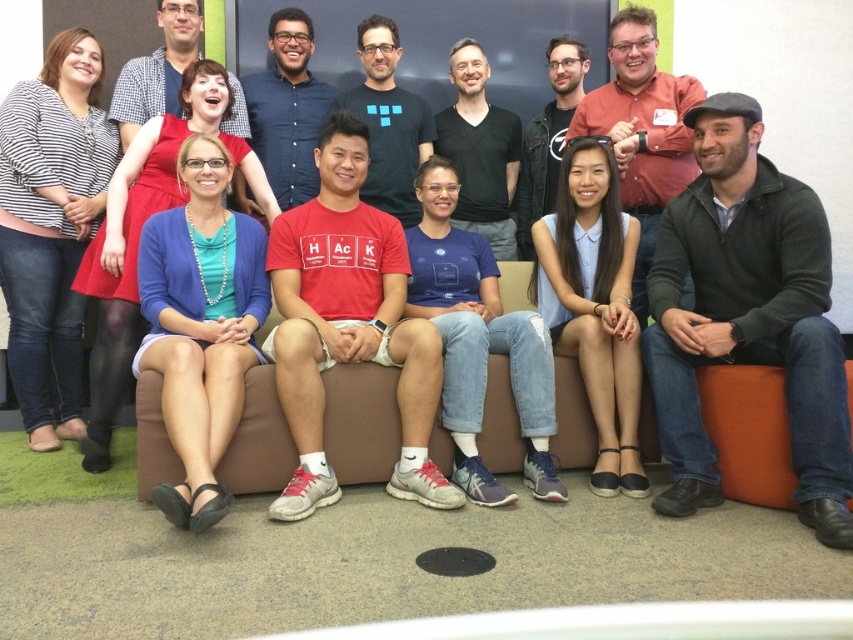
Is the position of white cotton t-shirt at center less distant than that of blue cotton shirt at center?

That is True.

Can you confirm if white cotton t-shirt at center is wider than blue cotton shirt at center?

Yes.

Is point (358, 358) closer to viewer compared to point (476, 380)?

Yes.

At what (x,y) coordinates should I click in order to perform the action: click on white cotton t-shirt at center. Please return your answer as a coordinate pair (x, y). This screenshot has width=853, height=640. Looking at the image, I should click on (347, 324).

How distant is blue cotton shirt at center from light blue fabric shirt at center?

blue cotton shirt at center is 12.55 inches from light blue fabric shirt at center.

Is blue cotton shirt at center smaller than light blue fabric shirt at center?

Incorrect, blue cotton shirt at center is not smaller in size than light blue fabric shirt at center.

Identify the location of blue cotton shirt at center. (479, 340).

Does blue cotton shirt at center have a lesser height compared to matte blue cardigan at center?

Correct, blue cotton shirt at center is not as tall as matte blue cardigan at center.

Is point (432, 253) positioned after point (155, 166)?

Yes, it is behind point (155, 166).

This screenshot has width=853, height=640. I want to click on blue cotton shirt at center, so click(479, 340).